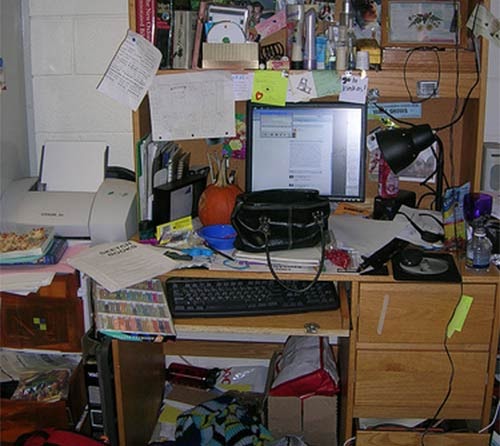
The height and width of the screenshot is (446, 500). Find the location of `wall`. wall is located at coordinates (83, 69).